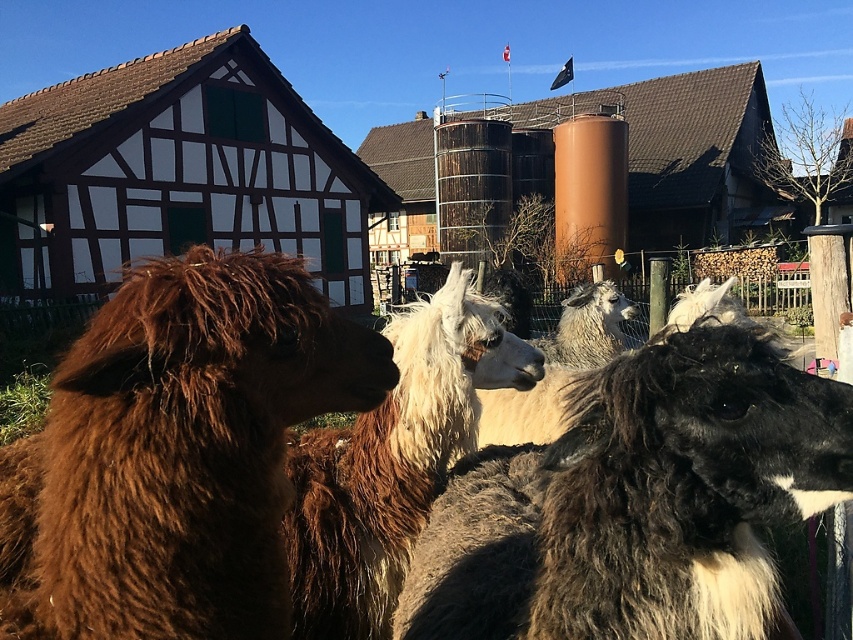
Question: Which of the following is the farthest from the observer?

Choices:
 (A) (204, 557)
 (B) (573, 314)
 (C) (361, 492)

Answer: (B)

Question: Which object is the closest to the brown fluffy alpaca at left?

Choices:
 (A) black woolly alpaca at center
 (B) white woolly alpaca at center

Answer: (A)

Question: Is brown woolen camel at lower left smaller than fluffy white alpaca at center?

Choices:
 (A) no
 (B) yes

Answer: (B)

Question: Which object is positioned farthest from the brown woolen camel at lower left?

Choices:
 (A) brown fluffy alpaca at left
 (B) black woolly alpaca at center

Answer: (B)

Question: Can you confirm if brown fluffy alpaca at left is positioned to the left of white woolly alpaca at center?

Choices:
 (A) no
 (B) yes

Answer: (B)

Question: Can you confirm if black woolly alpaca at center is smaller than fluffy white alpaca at center?

Choices:
 (A) no
 (B) yes

Answer: (B)